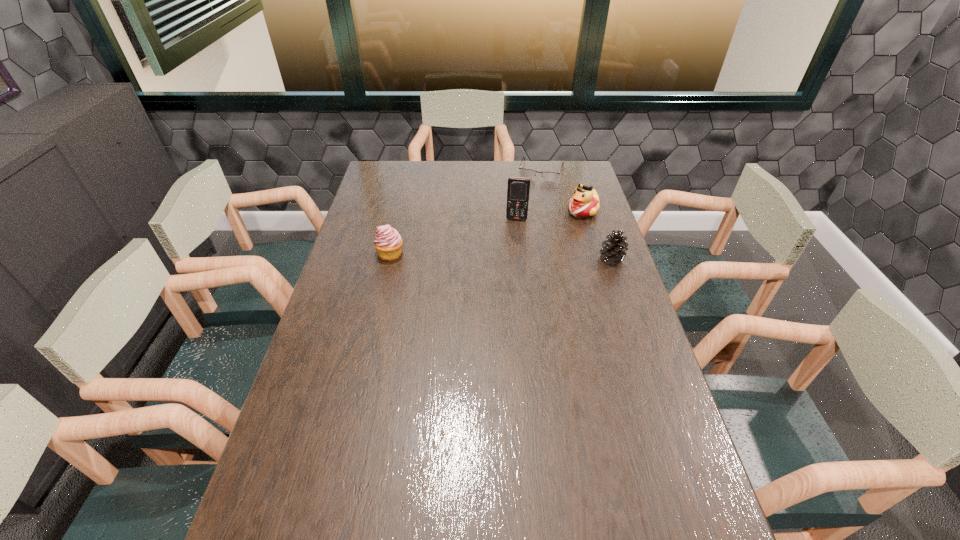
Locate an element on the screen. This screenshot has width=960, height=540. free space located 0.370m on the face of the duck is located at coordinates (508, 264).

Where is `free spot located on the front-facing side of the farthest object`? This screenshot has width=960, height=540. free spot located on the front-facing side of the farthest object is located at coordinates (528, 208).

The width and height of the screenshot is (960, 540). Find the location of `vacant space located 0.100m on the front-facing side of the farthest object`. vacant space located 0.100m on the front-facing side of the farthest object is located at coordinates (533, 194).

The width and height of the screenshot is (960, 540). I want to click on vacant area located 0.090m on the front-facing side of the farthest object, so click(534, 193).

I want to click on vacant space located on the screen of the cellular telephone, so click(515, 231).

This screenshot has width=960, height=540. In order to click on free space located on the screen of the cellular telephone in this screenshot , I will do `click(510, 269)`.

Where is `vacant position located on the screen of the cellular telephone`? The image size is (960, 540). vacant position located on the screen of the cellular telephone is located at coordinates (507, 288).

Identify the location of object positioned at the far edge. (526, 173).

Image resolution: width=960 pixels, height=540 pixels. Identify the location of object that is at the left edge. (388, 243).

The height and width of the screenshot is (540, 960). In order to click on pinecone that is at the right edge in this screenshot , I will do `click(614, 247)`.